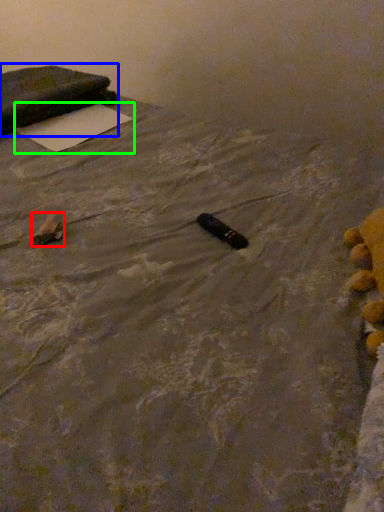
Question: Estimate the real-world distances between objects in this image. Which object is farther from waste (highlighted by a red box), furniture (highlighted by a blue box) or yoga mat (highlighted by a green box)?

Choices:
 (A) furniture
 (B) yoga mat

Answer: (A)